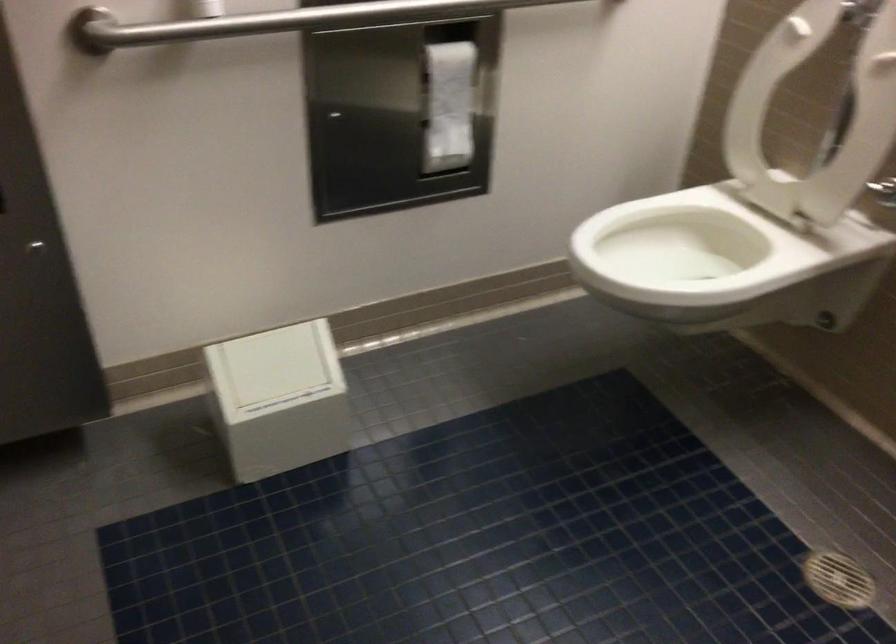
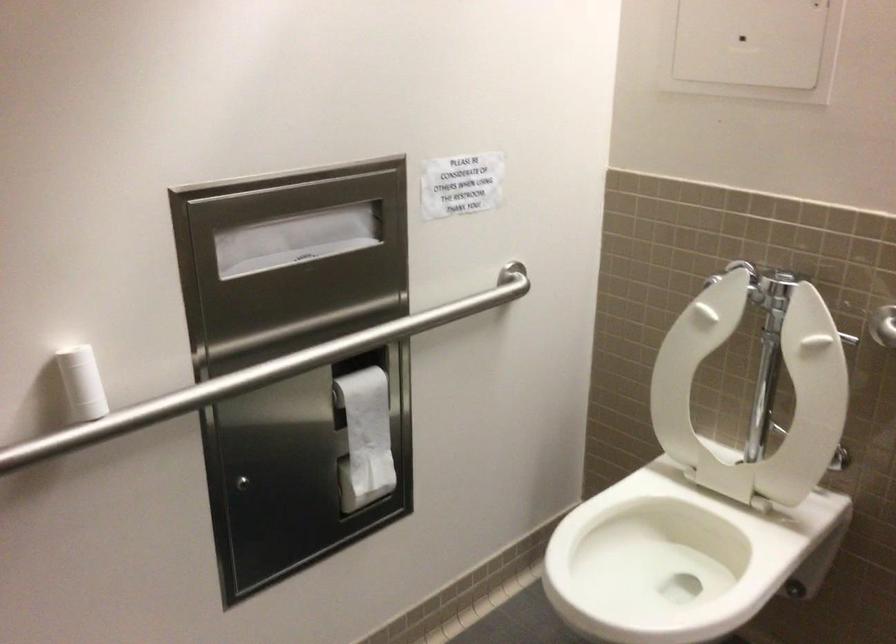
Question: The camera is either moving clockwise (left) or counter-clockwise (right) around the object. The first image is from the beginning of the video and the second image is from the end. Is the camera moving left or right when shooting the video?

Choices:
 (A) Left
 (B) Right

Answer: (A)